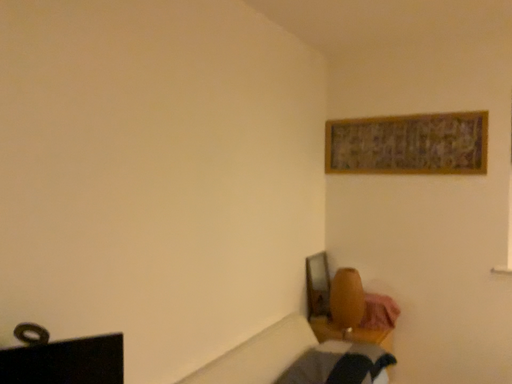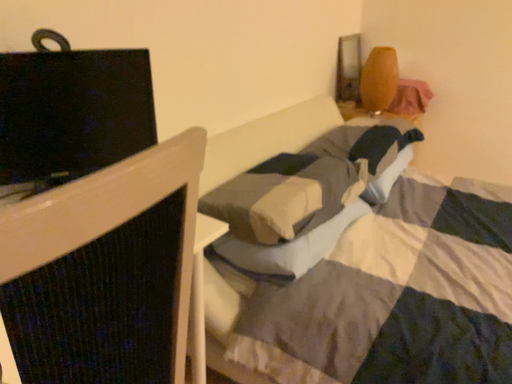
Question: Which way did the camera rotate in the video?

Choices:
 (A) rotated downward
 (B) rotated upward

Answer: (A)